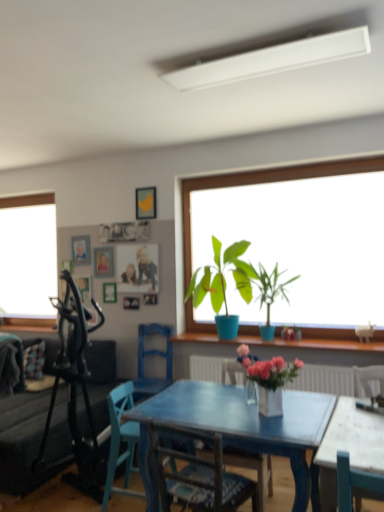
Question: Looking at their shapes, would you say blue wooden chair at center, the 4th chair viewed from the front, is wider or thinner than metallic gold picture frame at upper center, placed as the 4th picture frame when sorted from front to back?

Choices:
 (A) wide
 (B) thin

Answer: (A)

Question: From the image's perspective, is blue wooden chair at center, the 4th chair viewed from the front, above or below metallic gold picture frame at upper center, positioned as the third picture frame in bottom-to-top order?

Choices:
 (A) below
 (B) above

Answer: (A)

Question: Estimate the real-world distances between objects in this image. Which object is farther from the wooden picture frame at upper center, the third picture frame in the top-to-bottom sequence?

Choices:
 (A) wooden picture frame at upper center, which ranks as the 1th picture frame in bottom-to-top order
 (B) wooden picture frame at upper center, which appears as the first picture frame when viewed from the top
 (C) dark gray fabric couch at left
 (D) teal wooden chair at center, which appears as the 3th chair when viewed from the front
 (E) white matte rectangular light fixture at upper center

Answer: (E)

Question: Which is farther from the wooden picture frame at upper center, arranged as the 3th picture frame when viewed from the left?

Choices:
 (A) wooden chair at center, marked as the 3th chair in a back-to-front arrangement
 (B) wooden picture frame at upper center, which is counted as the 3th picture frame, starting from the right
 (C) white matte rectangular light fixture at upper center
 (D) blue wooden chair at center, which is the first chair from back to front
 (E) dark gray fabric couch at left

Answer: (C)